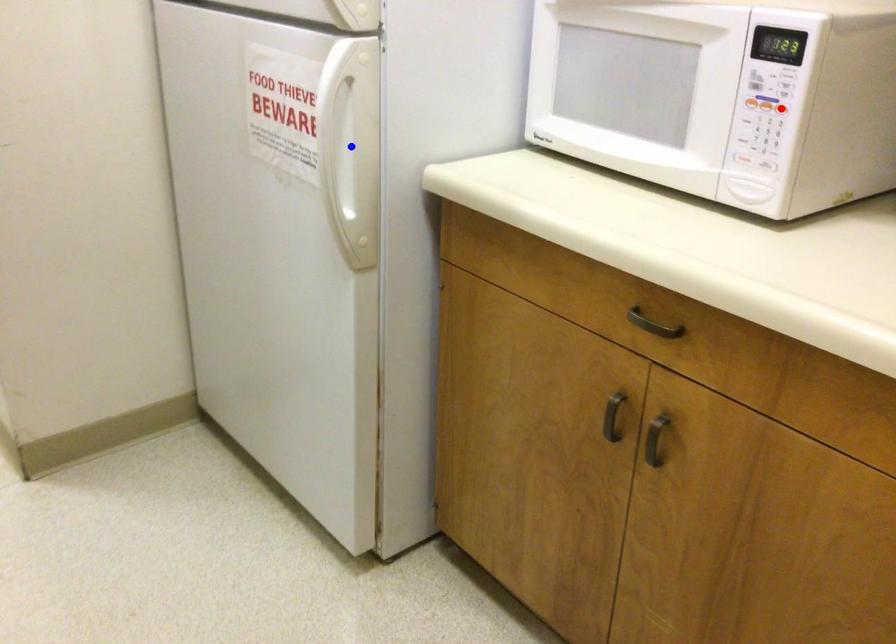
Question: Which of the two points in the image is closer to the camera?

Choices:
 (A) Blue point is closer.
 (B) Red point is closer.

Answer: (B)